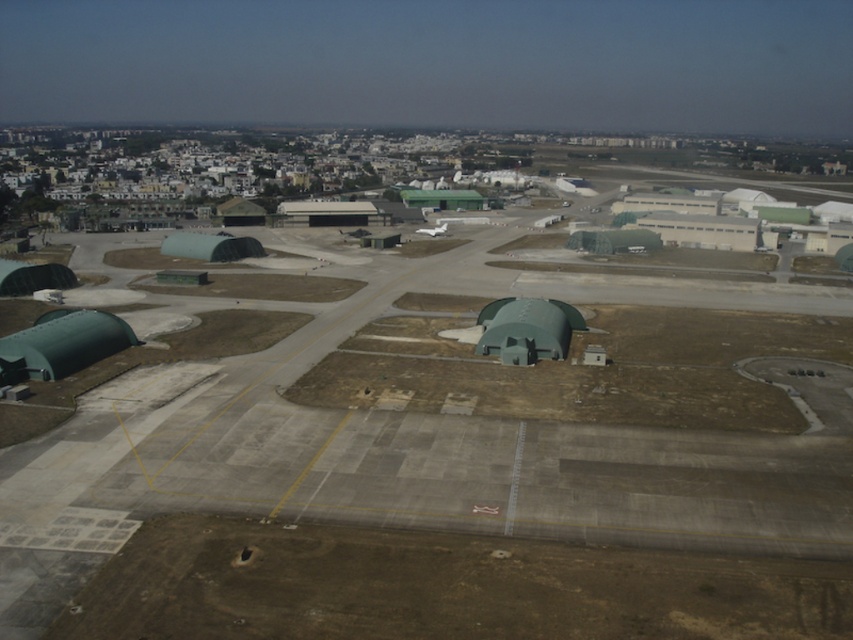
Question: Which point is closer to the camera taking this photo?

Choices:
 (A) (201, 250)
 (B) (27, 328)

Answer: (B)

Question: Does green matte hangar at center appear on the right side of green matte hangar at center-left?

Choices:
 (A) no
 (B) yes

Answer: (B)

Question: Can you confirm if green matte hangar at lower left is positioned to the left of green matte hangar at center?

Choices:
 (A) yes
 (B) no

Answer: (A)

Question: Estimate the real-world distances between objects in this image. Which object is closer to the green matte hangar at center-left?

Choices:
 (A) green matte hangar at lower left
 (B) green matte hangar at center

Answer: (A)

Question: Which is farther from the green matte hangar at center-left?

Choices:
 (A) green matte hangar at lower left
 (B) green matte hangar at center

Answer: (B)

Question: Can you confirm if green matte hangar at lower left is positioned above green matte hangar at center?

Choices:
 (A) yes
 (B) no

Answer: (B)